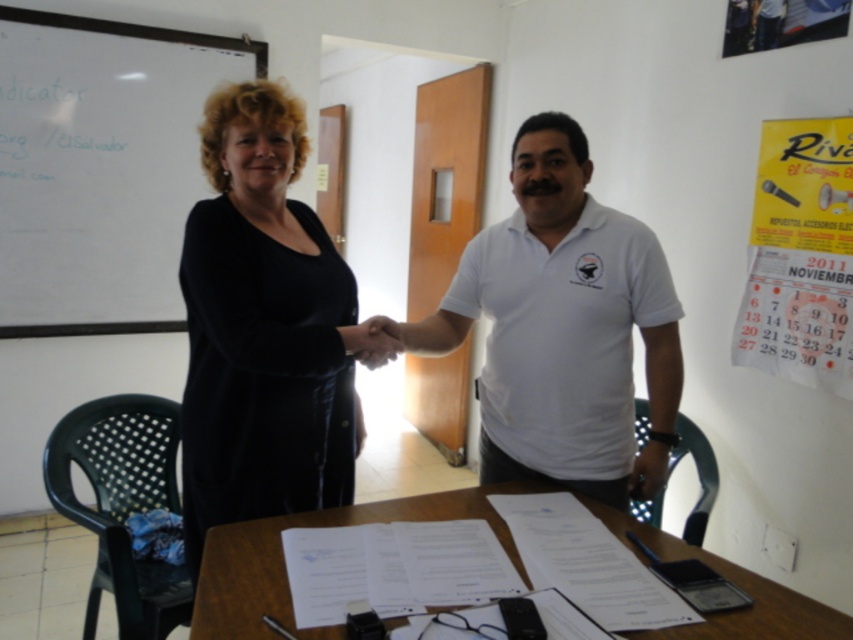
Question: Is black matte dress at center positioned at the back of white cotton shirt at center?

Choices:
 (A) no
 (B) yes

Answer: (A)

Question: Which of the following is the farthest from the observer?

Choices:
 (A) (488, 352)
 (B) (76, 230)
 (C) (351, 316)
 (D) (286, 592)

Answer: (B)

Question: Can you confirm if black matte dress at center is positioned above white paper at center?

Choices:
 (A) yes
 (B) no

Answer: (A)

Question: Estimate the real-world distances between objects in this image. Which object is closer to the black matte dress at center?

Choices:
 (A) whiteboard at upper left
 (B) yellow paper calendar at upper right
 (C) white cotton shirt at center

Answer: (C)

Question: Does white cotton shirt at center appear on the left side of white paper at center?

Choices:
 (A) yes
 (B) no

Answer: (B)

Question: Which point is closer to the camera?

Choices:
 (A) (263, 593)
 (B) (39, 272)
 (C) (229, 224)
 (D) (786, 148)

Answer: (A)